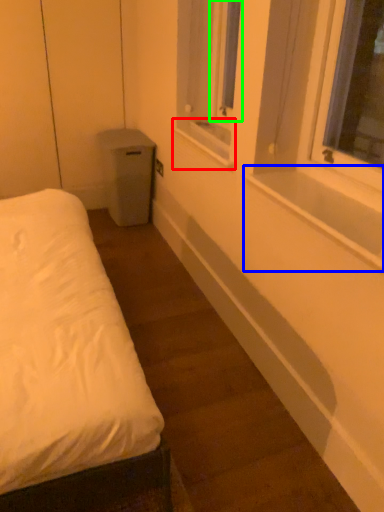
Question: Which is nearer to the window sill (highlighted by a red box)? window sill (highlighted by a blue box) or window screen (highlighted by a green box).

Choices:
 (A) window sill
 (B) window screen

Answer: (B)